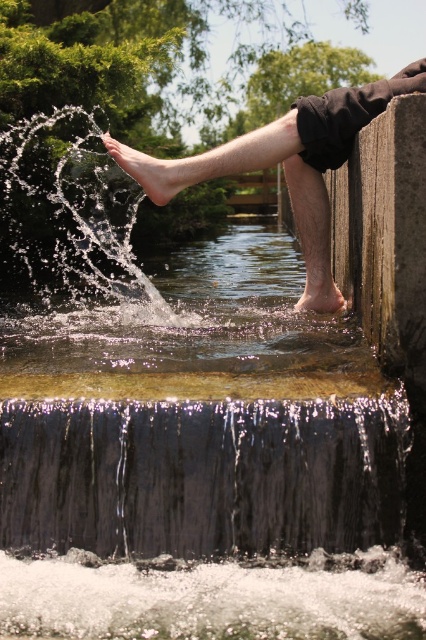
In the scene shown: Can you confirm if shiny metallic waterfall at lower center is positioned to the right of clear water at left?

Correct, you'll find shiny metallic waterfall at lower center to the right of clear water at left.

How distant is shiny metallic waterfall at lower center from clear water at left?

shiny metallic waterfall at lower center is 8.54 meters away from clear water at left.

Find the location of a particular element. This screenshot has height=640, width=426. shiny metallic waterfall at lower center is located at coordinates (206, 518).

Can you confirm if clear water at left is positioned to the left of barefoot skin at upper center?

Yes, clear water at left is to the left of barefoot skin at upper center.

Does clear water at left appear on the right side of barefoot skin at upper center?

No, clear water at left is not to the right of barefoot skin at upper center.

Does point (58, 161) come in front of point (304, 161)?

That is False.

Identify the location of clear water at left. This screenshot has width=426, height=640. (68, 212).

Is shiny metallic waterfall at lower center positioned in front of barefoot at center?

Yes, it is.

Is point (221, 515) farther from camera compared to point (307, 291)?

That is False.

Find the location of a particular element. shiny metallic waterfall at lower center is located at coordinates (206, 518).